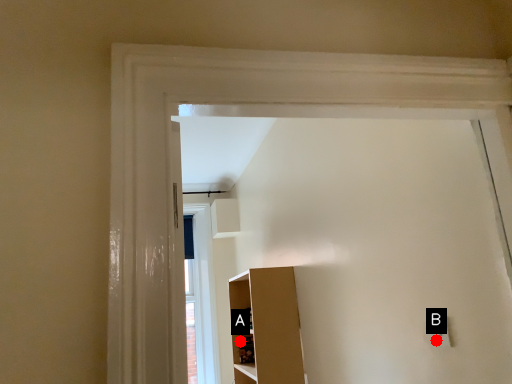
Question: Two points are circled on the image, labeled by A and B beside each circle. Among these points, which one is nearest to the camera?

Choices:
 (A) A is closer
 (B) B is closer

Answer: (B)